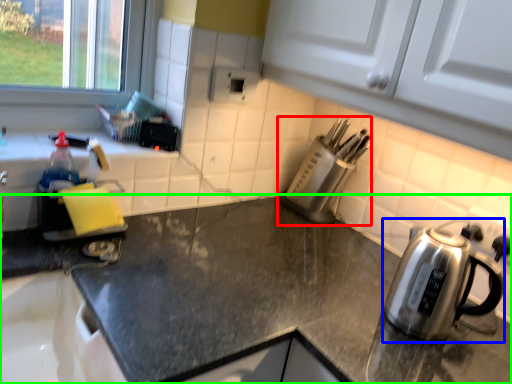
Question: Which object is positioned farthest from appliance (highlighted by a red box)? Select from kettle (highlighted by a blue box) and countertop (highlighted by a green box).

Choices:
 (A) kettle
 (B) countertop

Answer: (B)